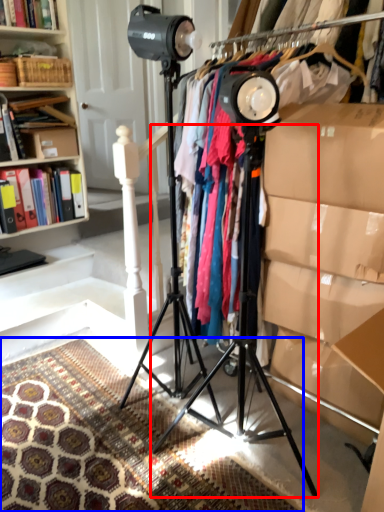
Question: Which of the following is the farthest to the observer, tripod (highlighted by a red box) or mat (highlighted by a blue box)?

Choices:
 (A) tripod
 (B) mat

Answer: (A)